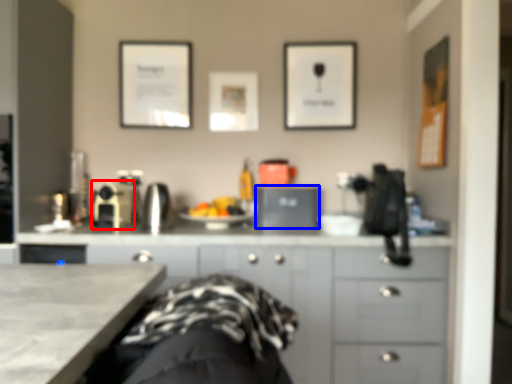
Question: Which point is closer to the camera, appliance (highlighted by a red box) or appliance (highlighted by a blue box)?

Choices:
 (A) appliance
 (B) appliance

Answer: (A)